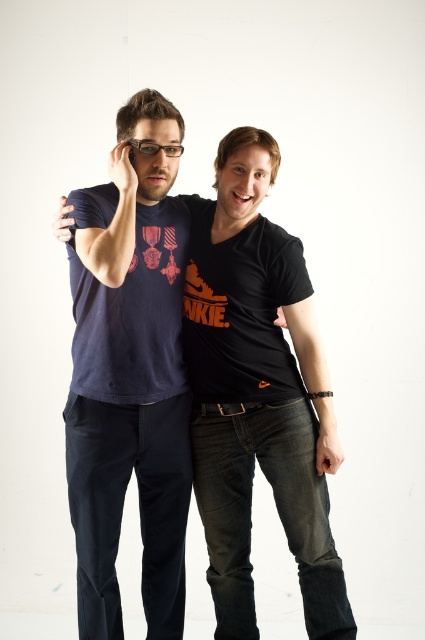
Is black leather bracelet at right bigger than matte black hand at lower right?

Indeed, black leather bracelet at right has a larger size compared to matte black hand at lower right.

Is black leather bracelet at right below matte black hand at lower right?

No.

The height and width of the screenshot is (640, 425). Identify the location of black leather bracelet at right. (308, 344).

At what (x,y) coordinates should I click in order to perform the action: click on black leather bracelet at right. Please return your answer as a coordinate pair (x, y). Image resolution: width=425 pixels, height=640 pixels. Looking at the image, I should click on (308, 344).

Does black leather bracelet at right appear under matte black hand at upper left?

Yes, black leather bracelet at right is below matte black hand at upper left.

Is black leather bracelet at right taller than matte black hand at upper left?

Yes, black leather bracelet at right is taller than matte black hand at upper left.

Locate an element on the screen. black leather bracelet at right is located at coordinates (308, 344).

Locate an element on the screen. black leather bracelet at right is located at coordinates (308, 344).

This screenshot has height=640, width=425. Find the location of `matte black hand at upper left`. matte black hand at upper left is located at coordinates (122, 170).

Does matte black hand at upper left have a greater width compared to matte black phone at upper left?

Indeed, matte black hand at upper left has a greater width compared to matte black phone at upper left.

Between point (133, 200) and point (62, 216), which one is positioned in front?

Point (133, 200) is more forward.

You are a GUI agent. You are given a task and a screenshot of the screen. Output one action in this format:
    pyautogui.click(x=<x>, y=<y>)
    Task: Click on the matte black hand at upper left
    The image size is (425, 640).
    Given the screenshot: What is the action you would take?
    pyautogui.click(x=122, y=170)